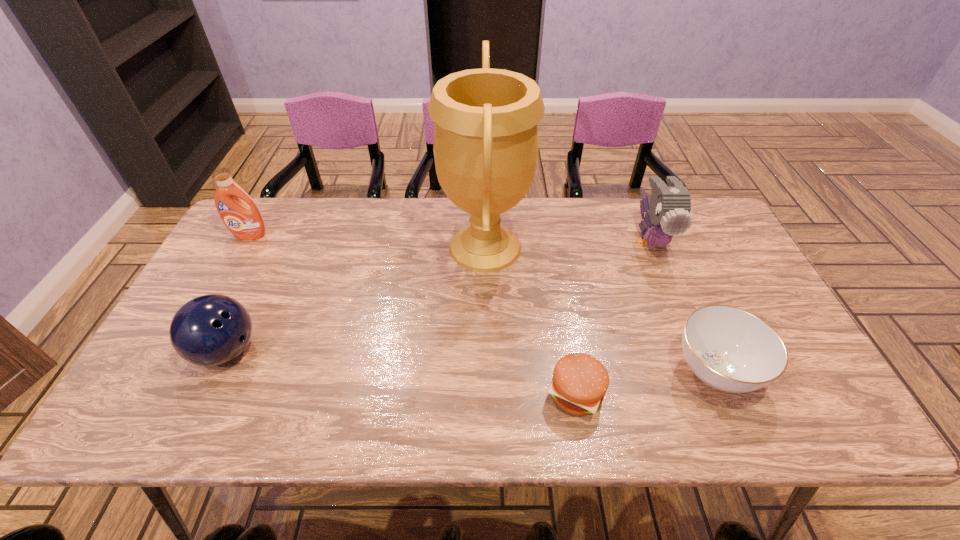
I want to click on empty location between the bird and the tallest object, so click(568, 244).

I want to click on empty space between the hamburger and the detergent, so click(413, 314).

This screenshot has height=540, width=960. Find the location of `unoccupied position between the bowling ball and the bird`. unoccupied position between the bowling ball and the bird is located at coordinates (439, 295).

The image size is (960, 540). In order to click on vacant region between the chinaware and the bird in this screenshot , I will do `click(683, 306)`.

Locate an element on the screen. vacant area that lies between the third shortest object and the bird is located at coordinates (439, 295).

Locate an element on the screen. vacant point located between the fourth tallest object and the hamburger is located at coordinates (401, 372).

The width and height of the screenshot is (960, 540). In order to click on free space between the bowling ball and the bird in this screenshot , I will do `click(439, 295)`.

At what (x,y) coordinates should I click in order to perform the action: click on vacant area between the second shortest object and the bird. Please return your answer as a coordinate pair (x, y). Image resolution: width=960 pixels, height=540 pixels. Looking at the image, I should click on (683, 306).

Where is `free spot between the bowling ball and the detergent`? The height and width of the screenshot is (540, 960). free spot between the bowling ball and the detergent is located at coordinates (238, 293).

This screenshot has width=960, height=540. Identify the location of vacant area between the trophy and the fifth tallest object. (600, 309).